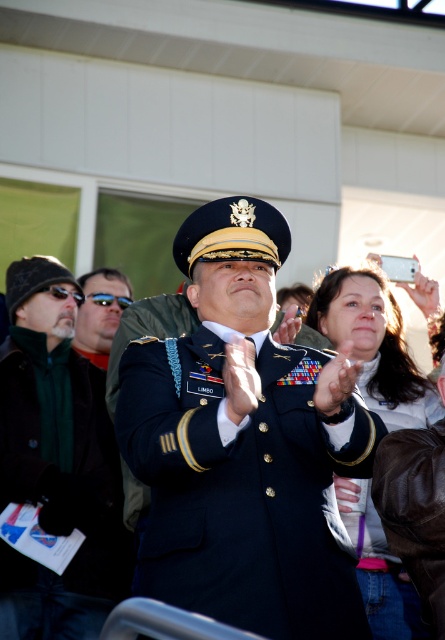
Who is more distant from viewer, [223,481] or [24,397]?

The point [24,397] is more distant.

Does navy blue uniform at center appear over dark green wool jacket at left?

Correct, navy blue uniform at center is located above dark green wool jacket at left.

What are the coordinates of `navy blue uniform at center` in the screenshot? It's located at (245, 444).

Who is lower down, matte gray jacket at upper right or green matte sunglasses at left?

matte gray jacket at upper right is below.

Is matte gray jacket at upper right closer to the viewer compared to green matte sunglasses at left?

Yes, matte gray jacket at upper right is closer to the viewer.

Which is behind, point (392, 632) or point (108, 346)?

The point (108, 346) is more distant.

Identify the location of matte gray jacket at upper right. The width and height of the screenshot is (445, 640). (375, 344).

Which is below, dark green wool jacket at left or matte gray jacket at upper right?

dark green wool jacket at left is lower down.

Identify the location of dark green wool jacket at left. This screenshot has height=640, width=445. (56, 461).

The image size is (445, 640). I want to click on dark green wool jacket at left, so click(56, 461).